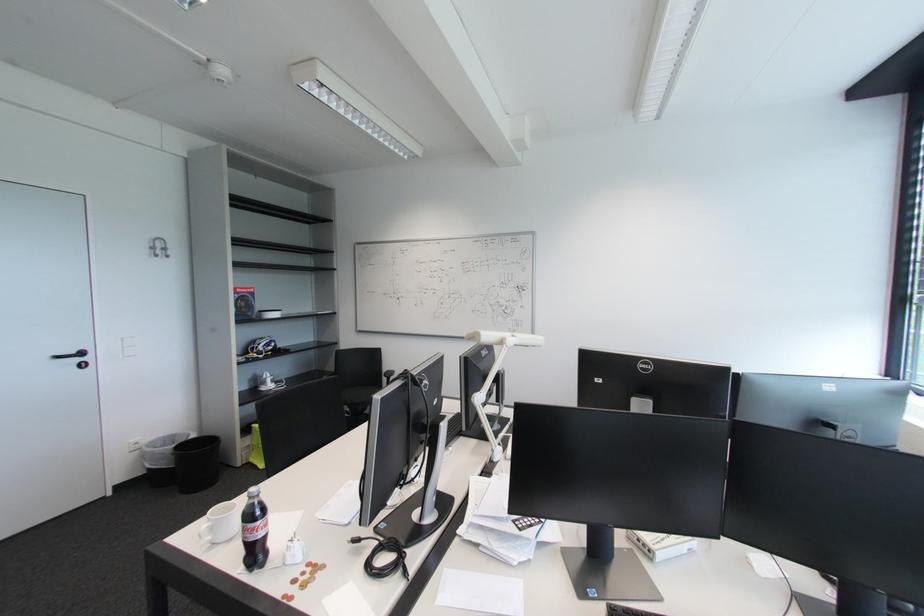
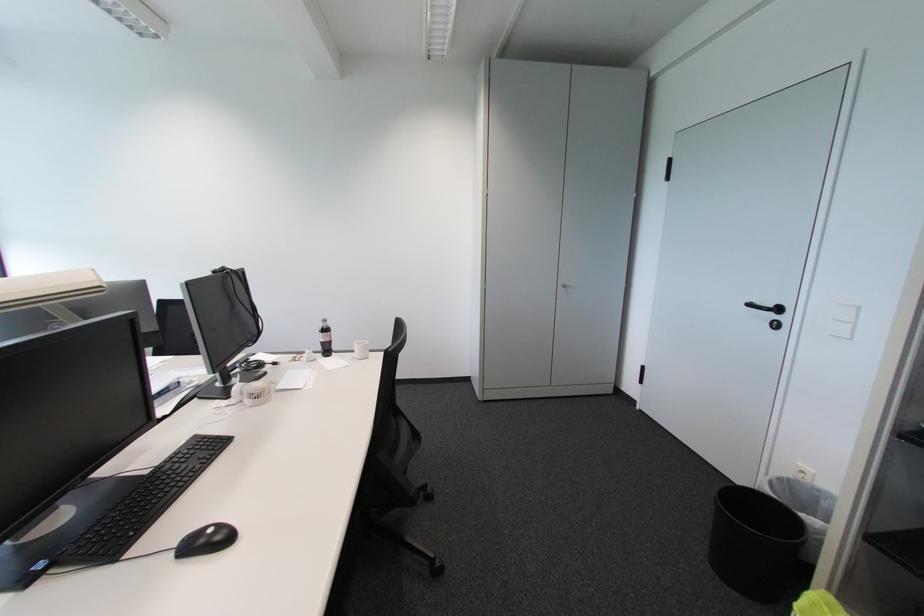
Locate, in the second image, the point that corresponds to point (83, 361) in the first image.

(777, 317)